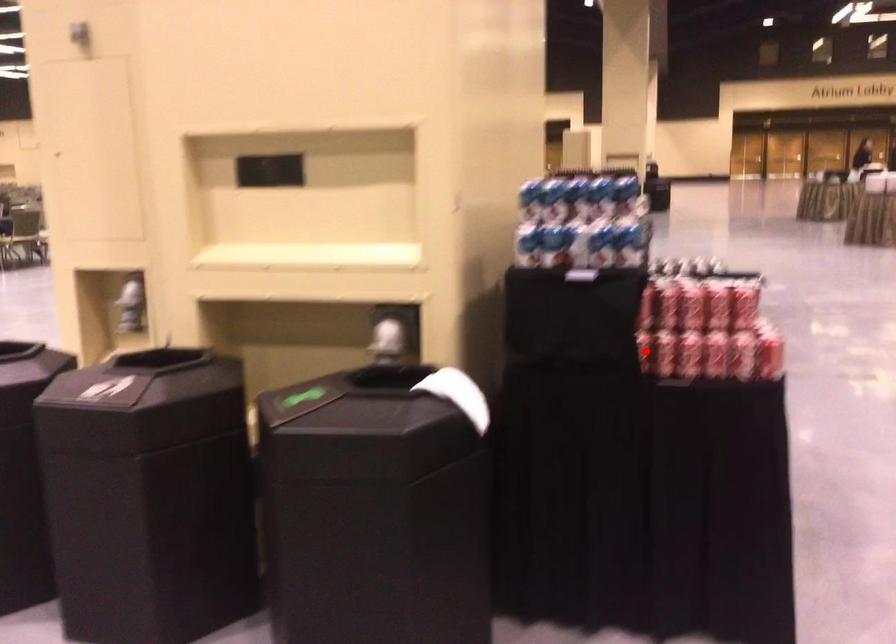
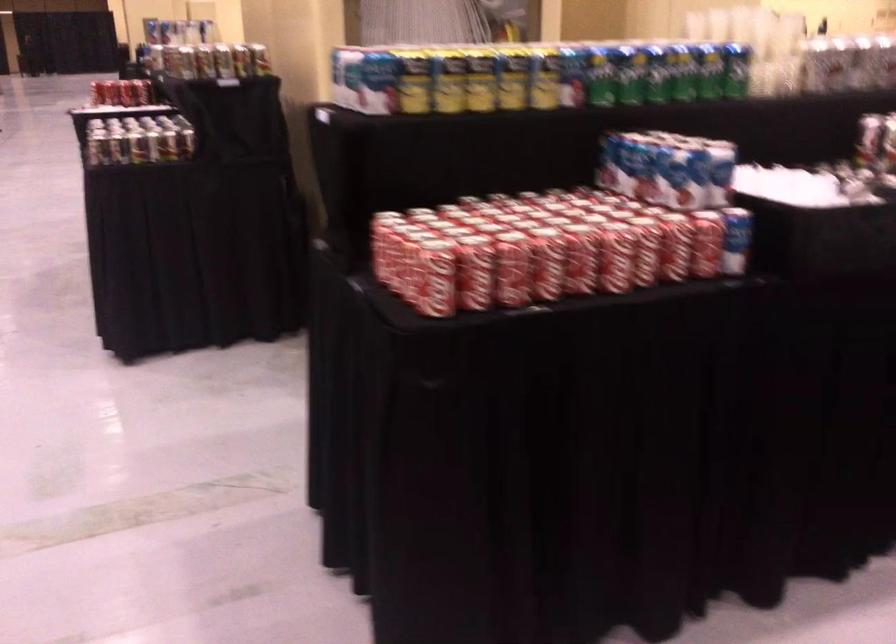
Question: I am providing you with two images of the same scene from different viewpoints. A red point is marked on the first image. At the location where the point appears in image 1, is it still visible in image 2?

Choices:
 (A) Yes
 (B) No

Answer: (B)